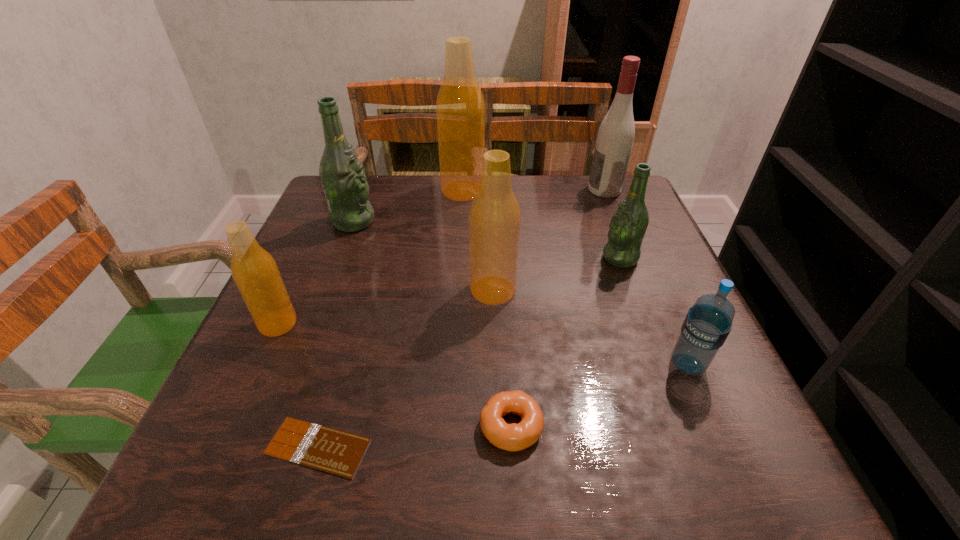
Identify the location of doughnut that is positioned at the near edge. This screenshot has width=960, height=540. (513, 437).

The width and height of the screenshot is (960, 540). In order to click on chocolate bar situated at the near edge in this screenshot , I will do `click(337, 452)`.

Locate an element on the screen. chocolate bar that is at the left edge is located at coordinates (337, 452).

Identify the location of alcohol that is positioned at the right edge. (615, 137).

Find the location of a particular element. The image size is (960, 540). beer bottle present at the right edge is located at coordinates (628, 225).

Locate an element on the screen. water bottle positioned at the right edge is located at coordinates [708, 322].

Locate an element on the screen. This screenshot has width=960, height=540. object at the far left corner is located at coordinates (342, 175).

Locate an element on the screen. This screenshot has height=540, width=960. object at the near left corner is located at coordinates (337, 452).

Image resolution: width=960 pixels, height=540 pixels. In order to click on object that is at the far right corner in this screenshot , I will do `click(615, 137)`.

The height and width of the screenshot is (540, 960). I want to click on vacant space at the far edge, so click(559, 188).